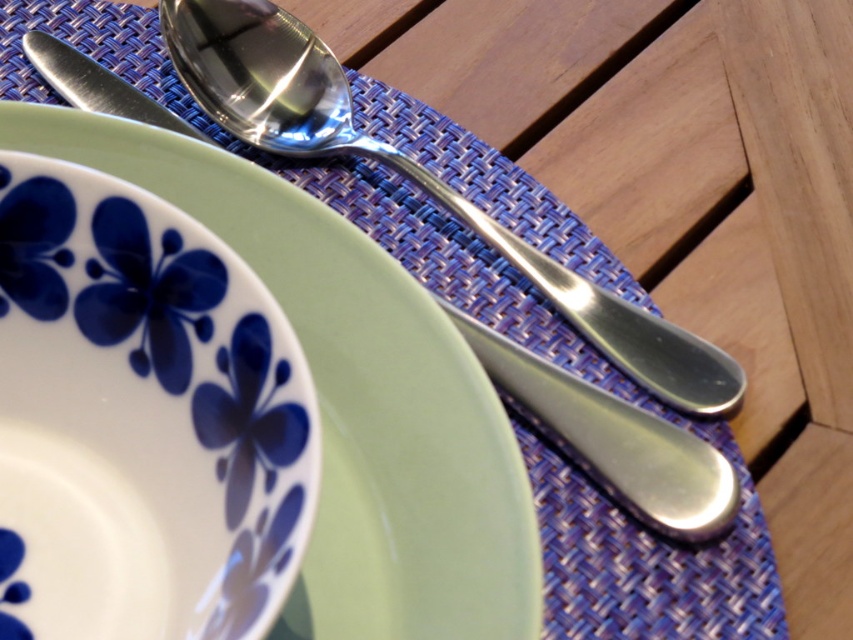
You are setting up a table for a dinner party and need to place a decorative centerpiece between the green ceramic plate at upper left and the polished metal spoon at upper center. Based on their sizes, which object should you position closer to the edge of the table to ensure the centerpiece fits comfortably?

The green ceramic plate at upper left has a lesser width compared to the polished metal spoon at upper center, so you should position the green ceramic plate at upper left closer to the edge to allow enough space for the centerpiece.

You are arranging a table setting and need to place a centerpiece at the point marked by coordinates point (x=355, y=396). Based on the scene description, what object is located at this point?

The point (x=355, y=396) indicates the green ceramic plate at upper left.

You are setting up a table for a small dinner party. You have a green ceramic plate at upper left and a polished metal spoon at upper center. Which object is smaller in size?

The green ceramic plate at upper left is smaller than the polished metal spoon at upper center.